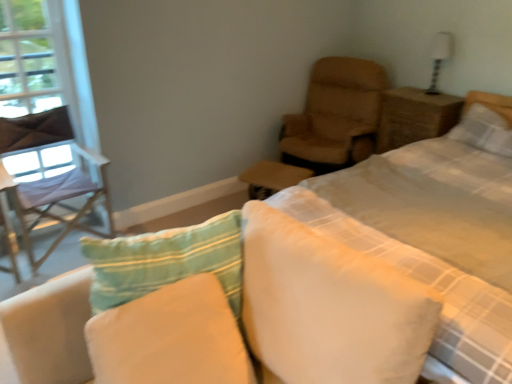
Question: Is light purple fabric chair at left, acting as the 1th chair starting from the left, thinner than white glossy table lamp at upper right?

Choices:
 (A) no
 (B) yes

Answer: (A)

Question: Is light purple fabric chair at left, which is the 2th chair from right to left, wider than white glossy table lamp at upper right?

Choices:
 (A) yes
 (B) no

Answer: (A)

Question: Does light purple fabric chair at left, which is the 2th chair from right to left, touch white glossy table lamp at upper right?

Choices:
 (A) no
 (B) yes

Answer: (A)

Question: Can you confirm if light purple fabric chair at left, which is the 2th chair from right to left, is taller than white glossy table lamp at upper right?

Choices:
 (A) no
 (B) yes

Answer: (B)

Question: Can you confirm if light purple fabric chair at left, acting as the 1th chair starting from the left, is positioned to the left of white glossy table lamp at upper right?

Choices:
 (A) no
 (B) yes

Answer: (B)

Question: From the image's perspective, is light purple fabric chair at left, which is the 2th chair from right to left, under white glossy table lamp at upper right?

Choices:
 (A) no
 (B) yes

Answer: (B)

Question: From the image's perspective, does transparent plastic window screen at left appear lower than white textured pillow at upper right, the third pillow when ordered from bottom to top?

Choices:
 (A) no
 (B) yes

Answer: (A)

Question: Is transparent plastic window screen at left not close to white textured pillow at upper right, the first pillow when ordered from right to left?

Choices:
 (A) no
 (B) yes

Answer: (B)

Question: Is the surface of transparent plastic window screen at left in direct contact with white textured pillow at upper right, placed as the 3th pillow when sorted from front to back?

Choices:
 (A) no
 (B) yes

Answer: (A)

Question: Does transparent plastic window screen at left have a greater height compared to white textured pillow at upper right, which is the 1th pillow from top to bottom?

Choices:
 (A) no
 (B) yes

Answer: (B)

Question: From the image's perspective, is transparent plastic window screen at left located above white textured pillow at upper right, placed as the 3th pillow when sorted from front to back?

Choices:
 (A) no
 (B) yes

Answer: (B)

Question: Is transparent plastic window screen at left at the left side of white textured pillow at upper right, the 1th pillow in the back-to-front sequence?

Choices:
 (A) yes
 (B) no

Answer: (A)

Question: From the image's perspective, is soft cotton pillow at center, marked as the third pillow in a back-to-front arrangement, below leather-like tan chair at upper right, the first chair in the right-to-left sequence?

Choices:
 (A) no
 (B) yes

Answer: (B)